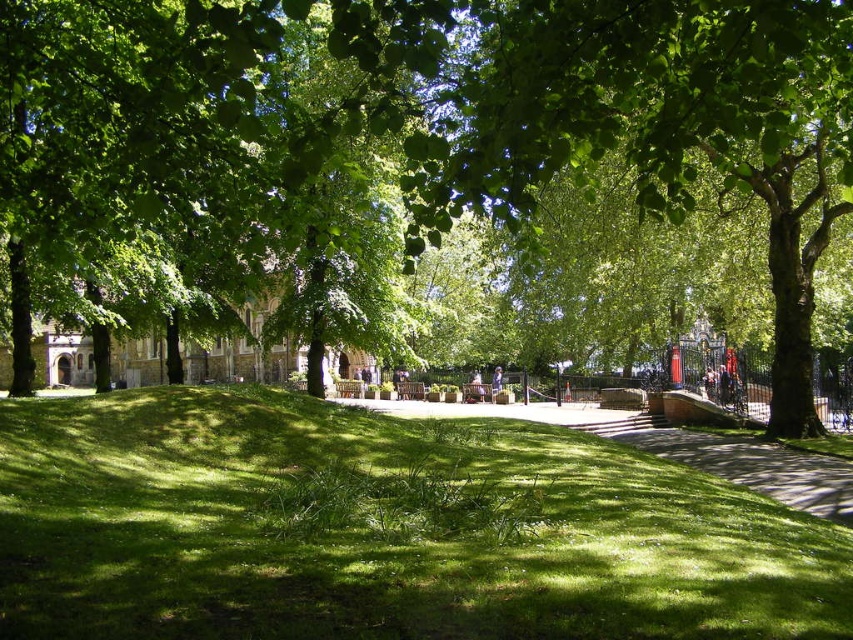
Does green grassy hill at center have a smaller size compared to green grass at center?

Yes.

Which of these two, green grassy hill at center or green grass at center, stands shorter?

With less height is green grassy hill at center.

At what (x,y) coordinates should I click in order to perform the action: click on green grassy hill at center. Please return your answer as a coordinate pair (x, y). The height and width of the screenshot is (640, 853). Looking at the image, I should click on (381, 529).

Identify the location of green grassy hill at center. (381, 529).

Does green leafy tree at center have a greater width compared to green grassy hill at center?

Indeed, green leafy tree at center has a greater width compared to green grassy hill at center.

Between point (685, 179) and point (804, 520), which one is positioned in front?

Point (685, 179)

At what (x,y) coordinates should I click in order to perform the action: click on green leafy tree at center. Please return your answer as a coordinate pair (x, y). Looking at the image, I should click on (428, 161).

Does green leafy tree at center appear on the left side of green grass at center?

Indeed, green leafy tree at center is positioned on the left side of green grass at center.

Does point (181, 6) come closer to viewer compared to point (724, 465)?

Yes, point (181, 6) is closer to viewer.

Is point (155, 244) positioned after point (631, 426)?

No.

At what (x,y) coordinates should I click in order to perform the action: click on green leafy tree at center. Please return your answer as a coordinate pair (x, y). Looking at the image, I should click on (428, 161).